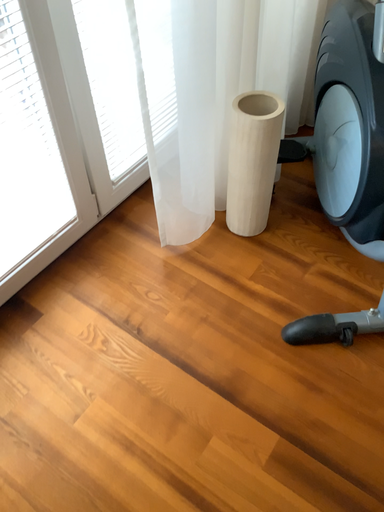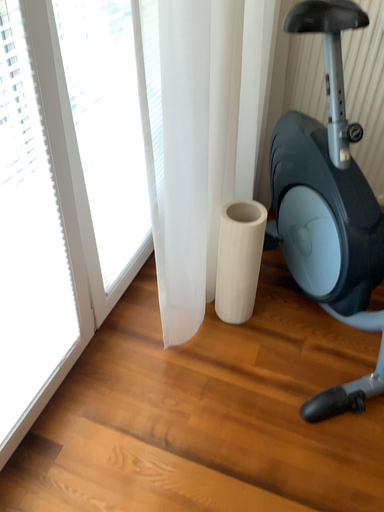
Question: How did the camera likely rotate when shooting the video?

Choices:
 (A) rotated left
 (B) rotated right

Answer: (B)